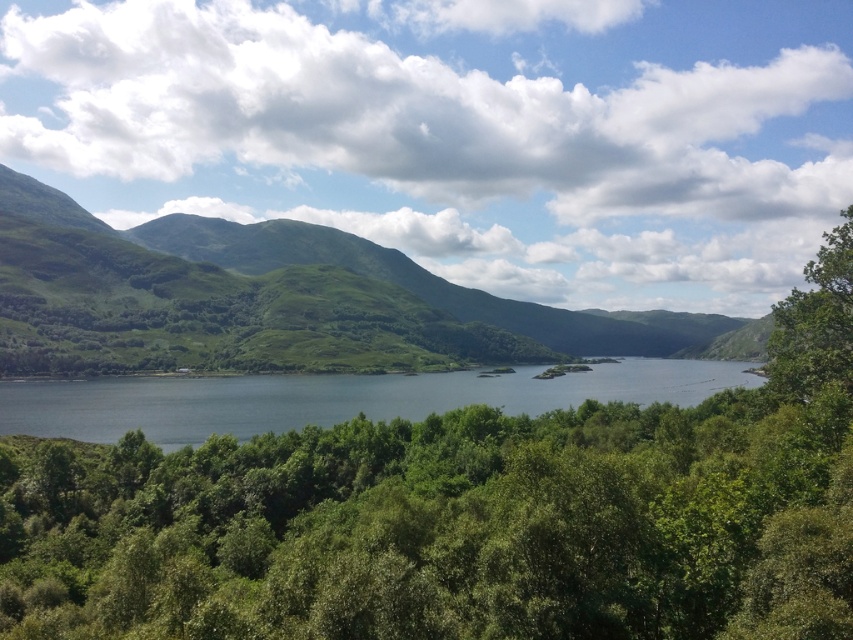
Question: Is green grassy hill at center to the right of blue water at center from the viewer's perspective?

Choices:
 (A) no
 (B) yes

Answer: (A)

Question: Is the position of blue water at center less distant than that of green leafy tree at right?

Choices:
 (A) yes
 (B) no

Answer: (B)

Question: Estimate the real-world distances between objects in this image. Which object is closer to the green grassy hill at center?

Choices:
 (A) green leafy tree at right
 (B) green leafy trees at center
 (C) blue water at center

Answer: (C)

Question: Which point appears farthest from the camera in this image?

Choices:
 (A) (839, 228)
 (B) (184, 461)

Answer: (B)

Question: Can you confirm if green leafy trees at center is positioned to the right of green grassy hill at center?

Choices:
 (A) yes
 (B) no

Answer: (A)

Question: Among these points, which one is farthest from the camera?

Choices:
 (A) (665, 384)
 (B) (125, 563)

Answer: (A)